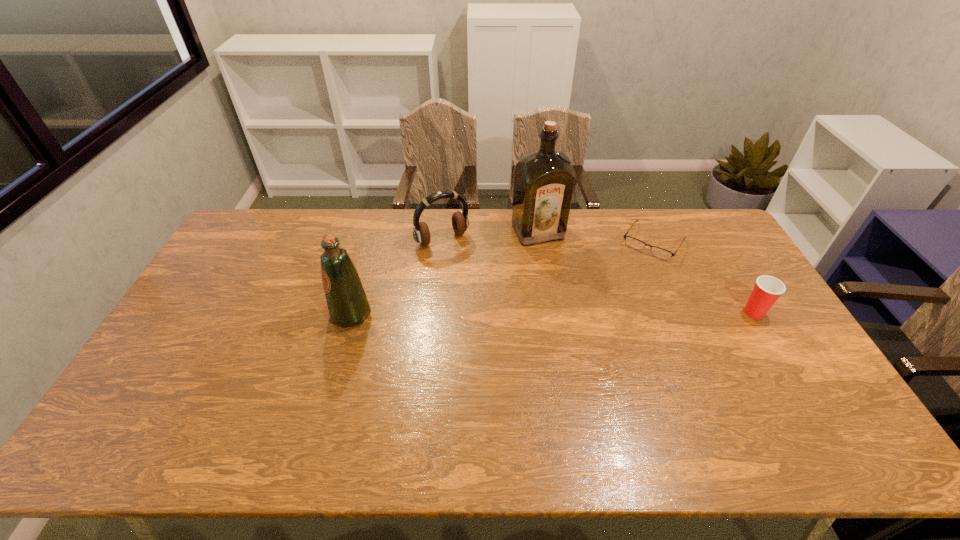
Image resolution: width=960 pixels, height=540 pixels. Identify the location of free point located 0.100m on the label of the tallest object. (558, 265).

Identify the location of free space located on the label of the tallest object. (568, 285).

Identify the location of vacant region located 0.300m on the label of the tallest object. Image resolution: width=960 pixels, height=540 pixels. (582, 307).

I want to click on spectacles present at the far edge, so click(632, 242).

At what (x,y) coordinates should I click in order to perform the action: click on headset at the far edge. Please return your answer as a coordinate pair (x, y). Looking at the image, I should click on (460, 223).

This screenshot has width=960, height=540. I want to click on liquor at the far edge, so click(x=544, y=180).

What are the coordinates of `Dixie cup that is at the right edge` in the screenshot? It's located at (767, 289).

At what (x,y) coordinates should I click in order to perform the action: click on spectacles located at the right edge. Please return your answer as a coordinate pair (x, y). Looking at the image, I should click on (632, 242).

Find the location of `object at the far right corner`. object at the far right corner is located at coordinates (632, 242).

The image size is (960, 540). Find the location of `free space at the far edge of the desktop`. free space at the far edge of the desktop is located at coordinates (319, 246).